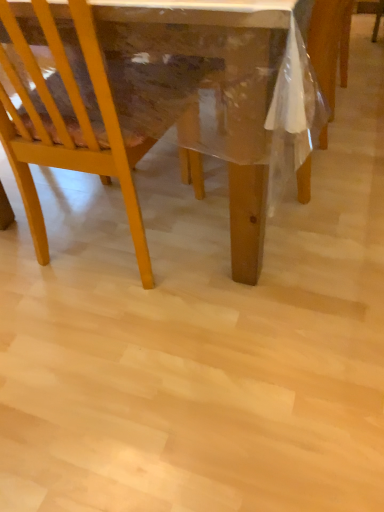
Where is `matte yellow chair at lower left`? matte yellow chair at lower left is located at coordinates (86, 116).

What do you see at coordinates (86, 116) in the screenshot? The image size is (384, 512). I see `matte yellow chair at lower left` at bounding box center [86, 116].

Find the location of a particular element. matte yellow chair at lower left is located at coordinates coord(86,116).